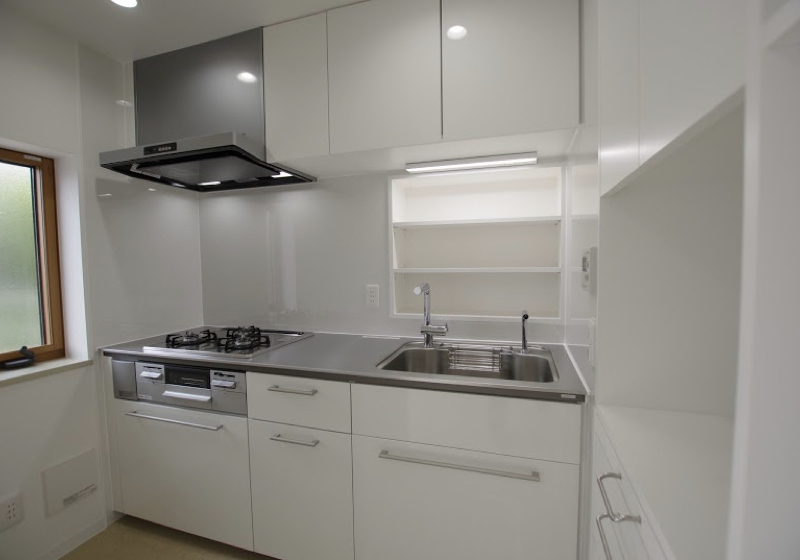
Where is `faucet`? The image size is (800, 560). faucet is located at coordinates (430, 315).